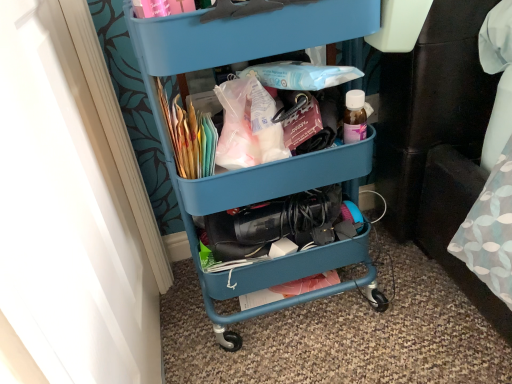
Locate an element on the screen. This screenshot has width=512, height=384. vacant space in front of blue plastic cart at center is located at coordinates (322, 359).